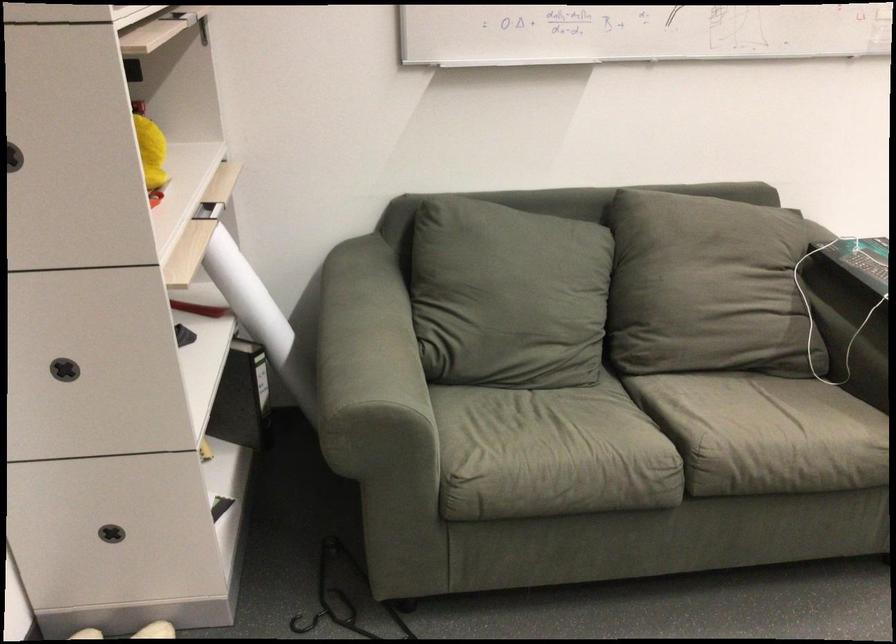
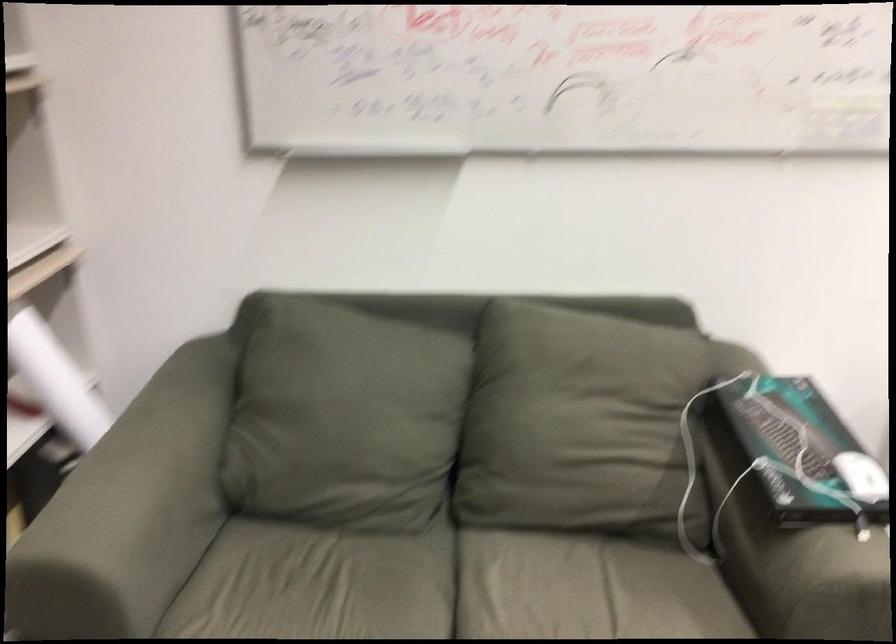
Question: The images are taken continuously from a first-person perspective. In which direction is your viewpoint rotating?

Choices:
 (A) Left
 (B) Right
 (C) Up
 (D) Down

Answer: (A)